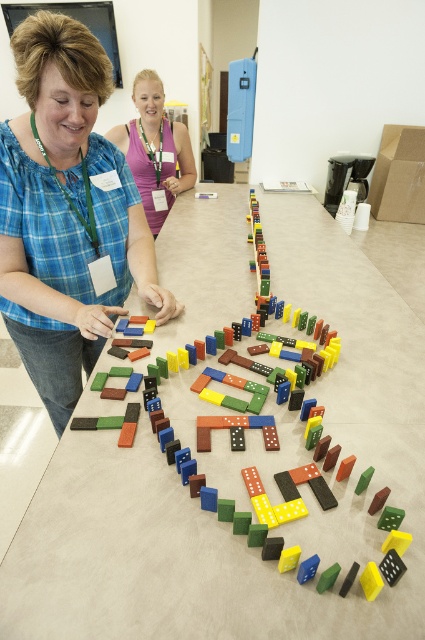
Can you confirm if wooden dominoes at center is bigger than matte blue shirt at center?

Indeed, wooden dominoes at center has a larger size compared to matte blue shirt at center.

Who is more distant from viewer, (320, 273) or (141, 225)?

Point (320, 273)

Identify the location of wooden dominoes at center. This screenshot has height=640, width=425. (215, 515).

Is wooden dominoes at center smaller than matte purple tank top at upper center?

No, wooden dominoes at center is not smaller than matte purple tank top at upper center.

Describe the element at coordinates (215, 515) in the screenshot. I see `wooden dominoes at center` at that location.

Who is more forward, (229, 196) or (125, 132)?

Point (125, 132) is more forward.

Where is `wooden dominoes at center`? wooden dominoes at center is located at coordinates (215, 515).

Does matte blue shirt at center appear on the left side of matte purple tank top at upper center?

No, matte blue shirt at center is not to the left of matte purple tank top at upper center.

Locate an element on the screen. This screenshot has width=425, height=640. matte blue shirt at center is located at coordinates (65, 212).